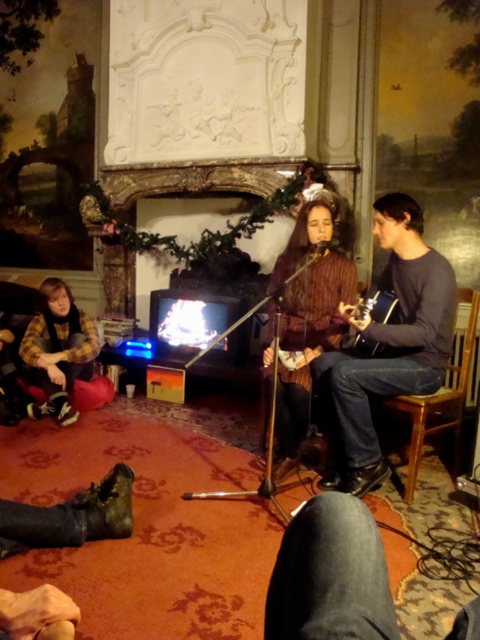
Question: Which point is farther to the camera?

Choices:
 (A) wooden acoustic guitar at center
 (B) striped sweater at center
 (C) flannel shirt at lower left
 (D) brown textured sweater at center

Answer: (C)

Question: Considering the relative positions of flannel shirt at lower left and wooden acoustic guitar at center in the image provided, where is flannel shirt at lower left located with respect to wooden acoustic guitar at center?

Choices:
 (A) left
 (B) right

Answer: (A)

Question: Is striped sweater at center bigger than flannel shirt at lower left?

Choices:
 (A) yes
 (B) no

Answer: (A)

Question: Which is nearer to the brown textured sweater at center?

Choices:
 (A) wooden acoustic guitar at center
 (B) flannel shirt at lower left
 (C) striped sweater at center

Answer: (A)

Question: Which object is the farthest from the wooden acoustic guitar at center?

Choices:
 (A) flannel shirt at lower left
 (B) striped sweater at center
 (C) brown textured sweater at center

Answer: (A)

Question: Is brown textured sweater at center bigger than striped sweater at center?

Choices:
 (A) yes
 (B) no

Answer: (A)